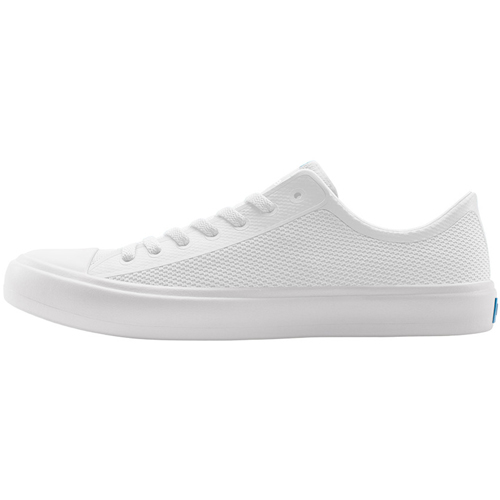
What are the coordinates of `fabric` in the screenshot? It's located at pos(366,262).